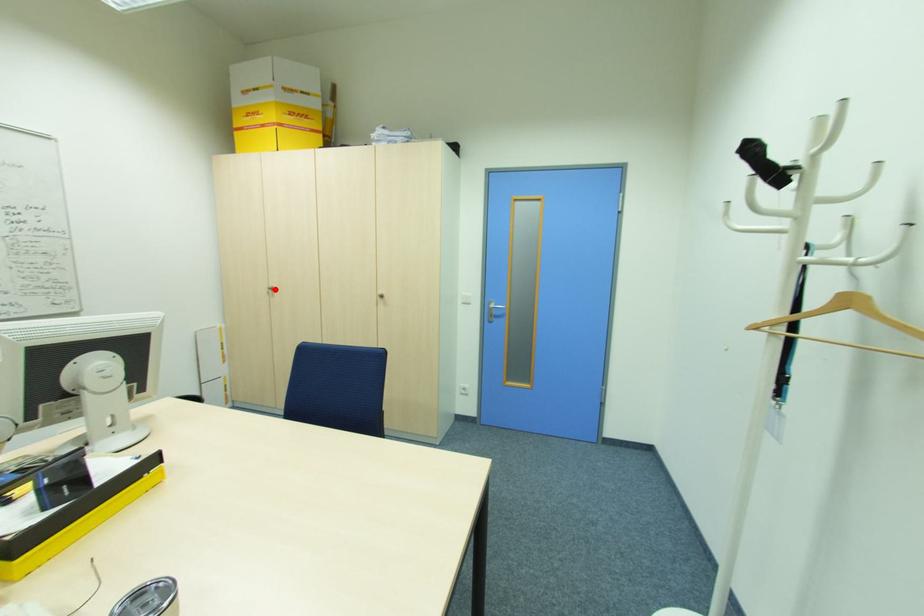
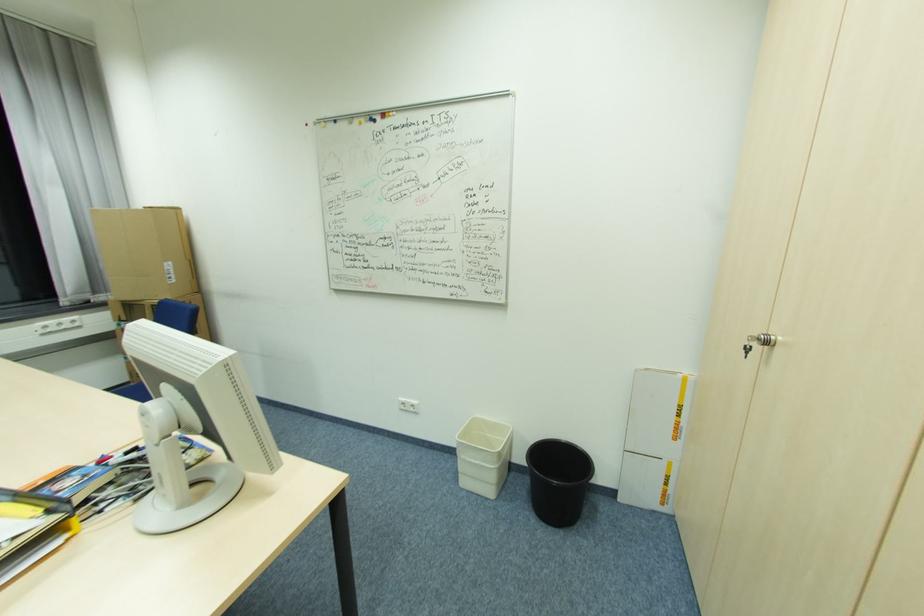
Find the pixel in the second image that matches the highlighted location in the first image.

(772, 344)